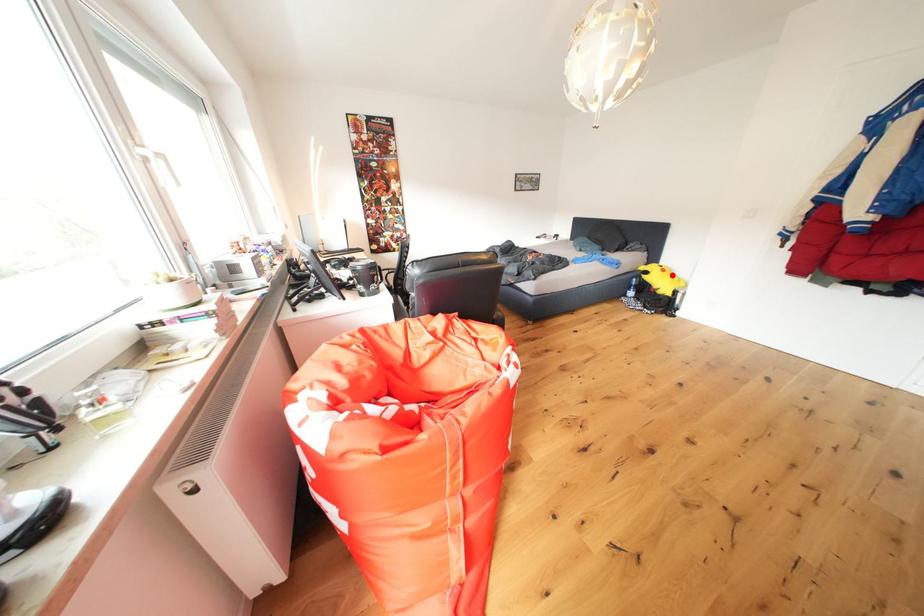
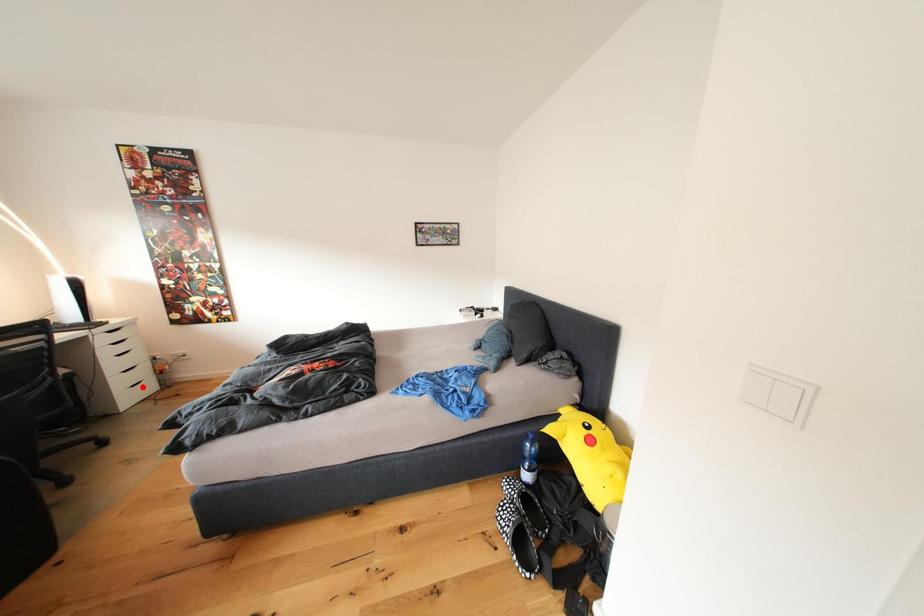
I am providing you with two images of the same scene from different viewpoints. A red point is marked on the first image and another point is marked on the second image. Is the marked point in image1 the same physical position as the marked point in image2?

No